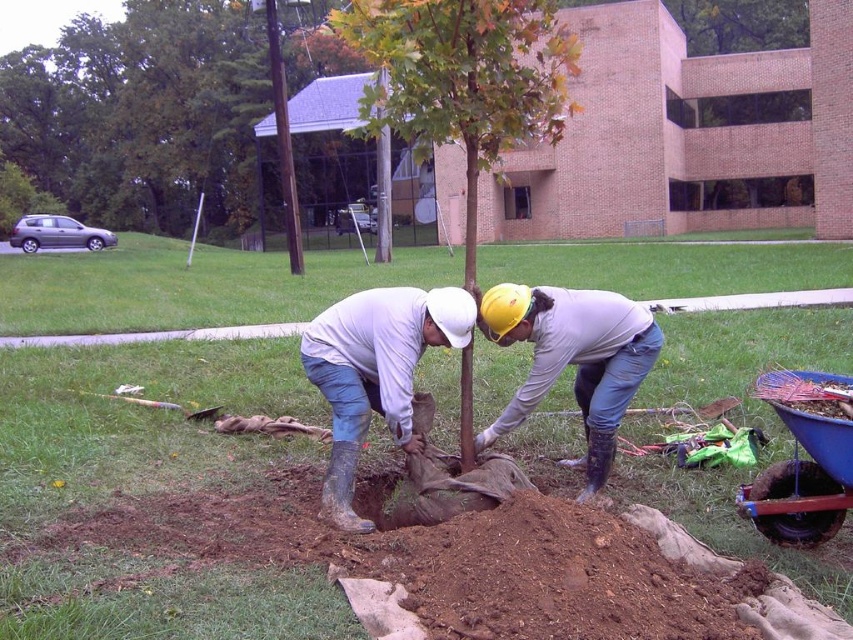
Question: Is white matte helmet at center positioned at the back of yellow hard hat at center?

Choices:
 (A) yes
 (B) no

Answer: (B)

Question: Estimate the real-world distances between objects in this image. Which object is farther from the green matte tree at center?

Choices:
 (A) yellow hard hat at center
 (B) white matte helmet at center

Answer: (B)

Question: Does green matte tree at center have a greater width compared to yellow hard hat at center?

Choices:
 (A) no
 (B) yes

Answer: (B)

Question: Which point is farther to the camera?

Choices:
 (A) (335, 390)
 (B) (625, 308)
 (C) (440, 22)

Answer: (B)

Question: Can you confirm if green matte tree at center is positioned below white matte helmet at center?

Choices:
 (A) no
 (B) yes

Answer: (A)

Question: Which is farther from the white matte helmet at center?

Choices:
 (A) yellow hard hat at center
 (B) green matte tree at center

Answer: (B)